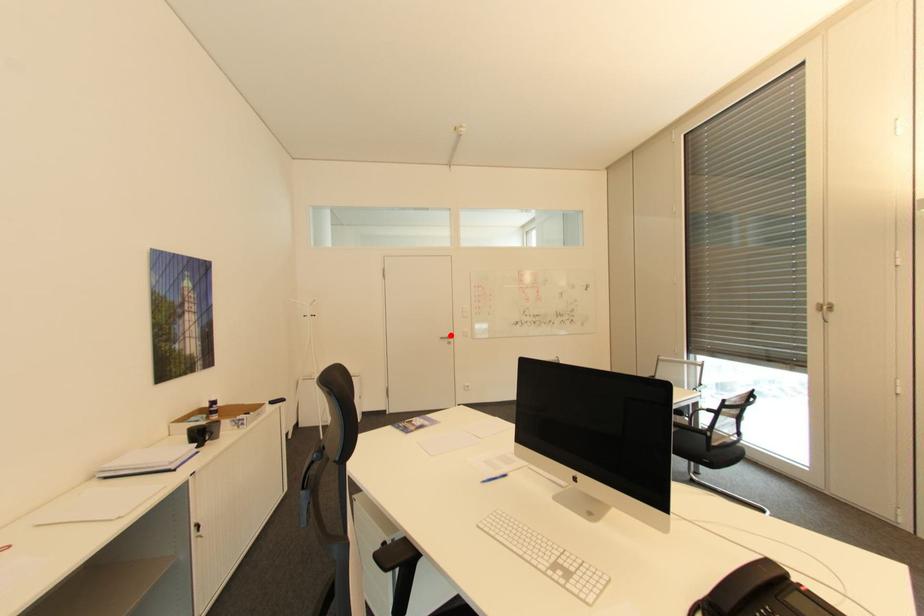
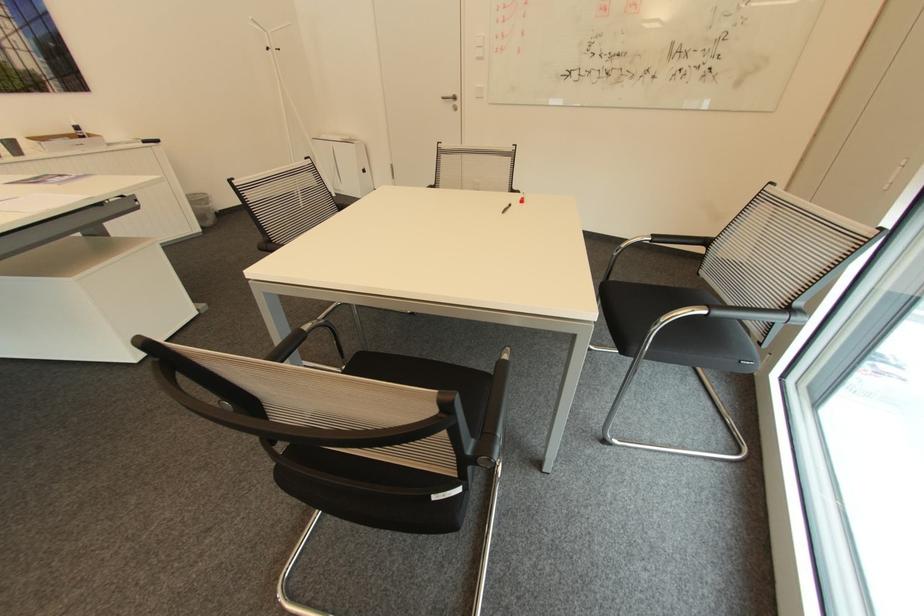
Where in the second image is the point corresponding to the highlighted location from the first image?

(456, 95)